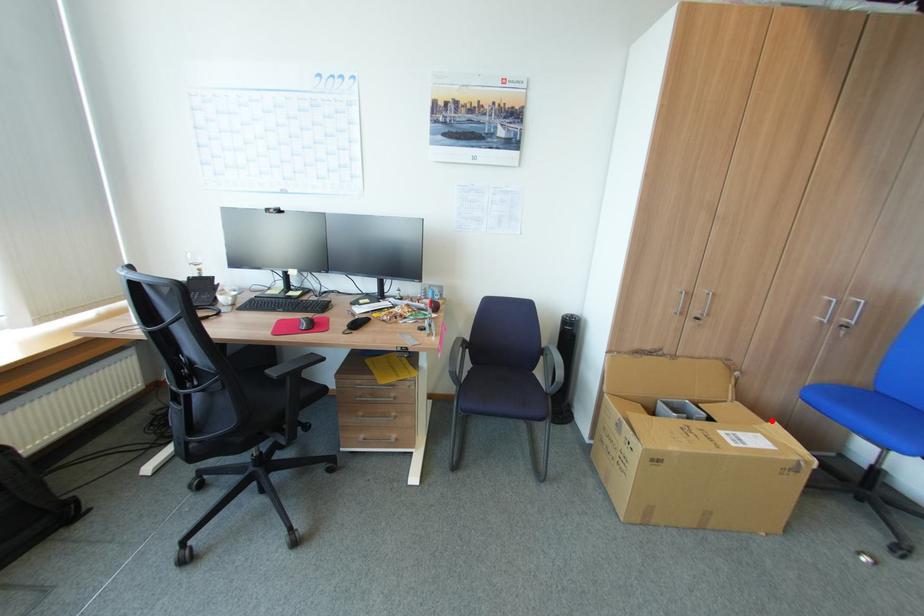
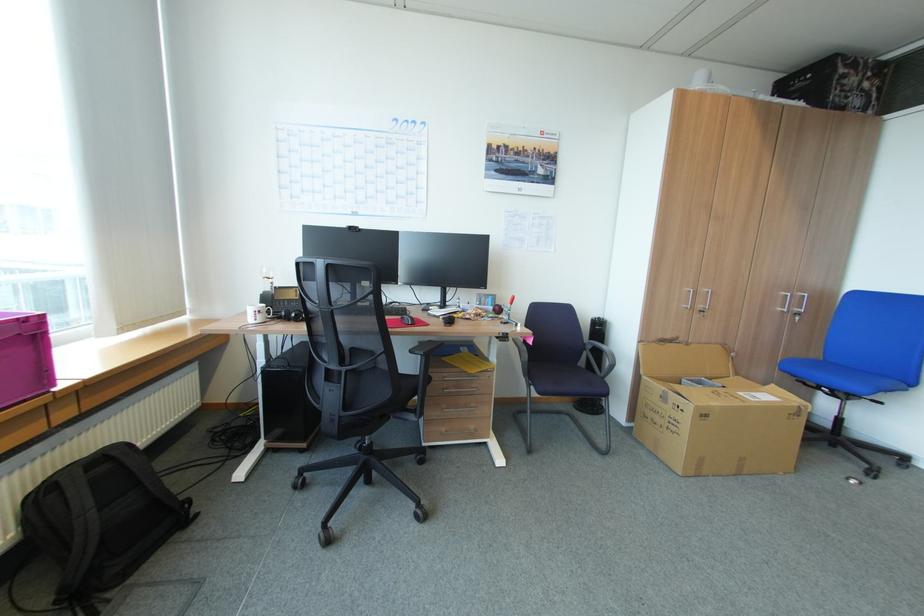
The point at the highlighted location is marked in the first image. Where is the corresponding point in the second image?

(771, 384)